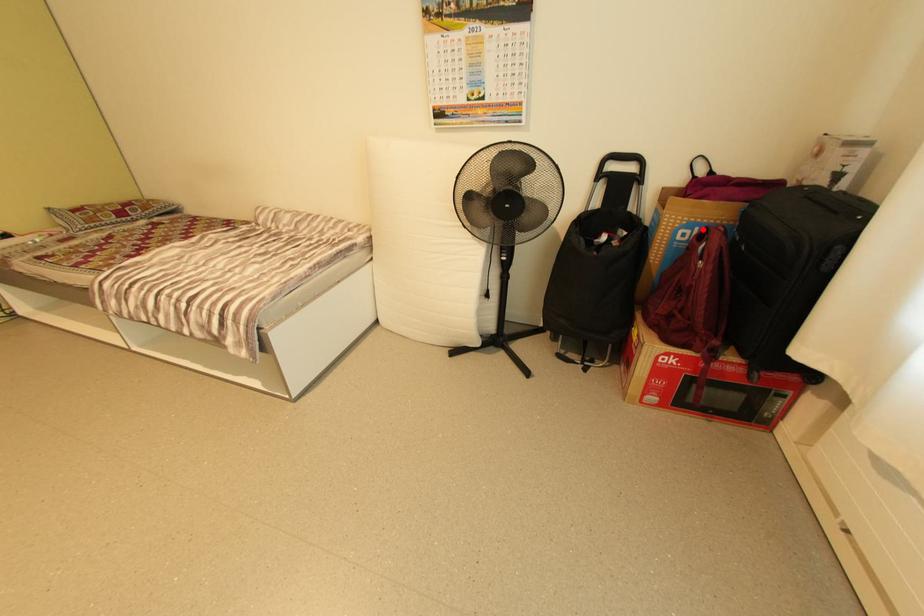
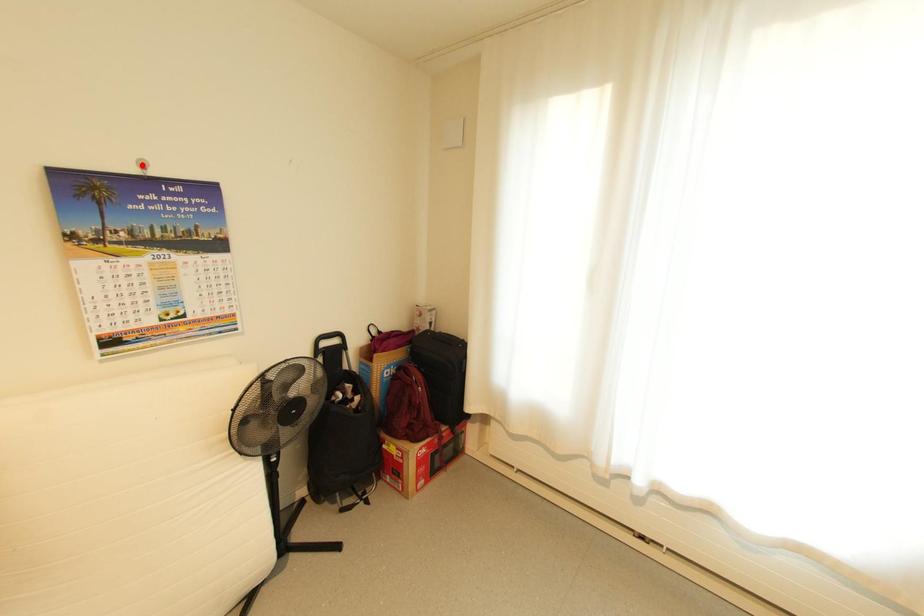
I am providing you with two images of the same scene from different viewpoints. A red point is marked on the first image and another point is marked on the second image. Is the marked point in image1 the same physical position as the marked point in image2?

No